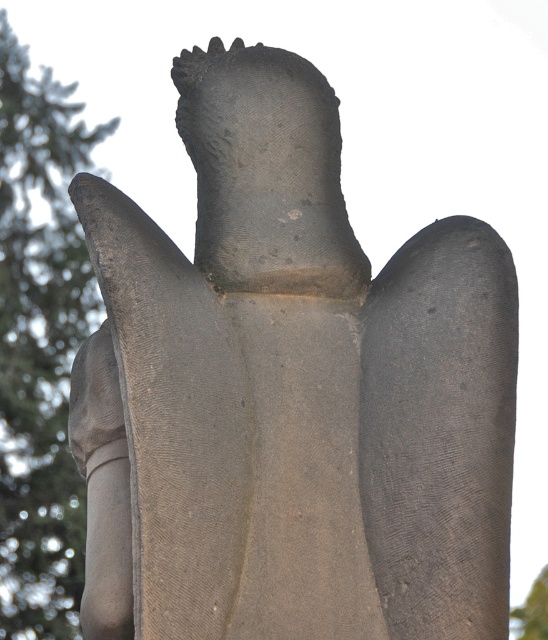
You are an artist sketching the scene and want to ensure proper proportions. Which tree should you draw first to establish the scale of the composition, the green textured tree at left or the green leafy tree at upper left?

The green textured tree at left is larger in size compared to the green leafy tree at upper left, so you should draw the green textured tree at left first to establish the scale of the composition.

You are standing in front of the statue and want to find the green textured tree at left. Based on the coordinates provided, where should you look relative to the statue?

The green textured tree at left is located at coordinates point (39, 344), which means it is positioned to the upper left side of the statue.